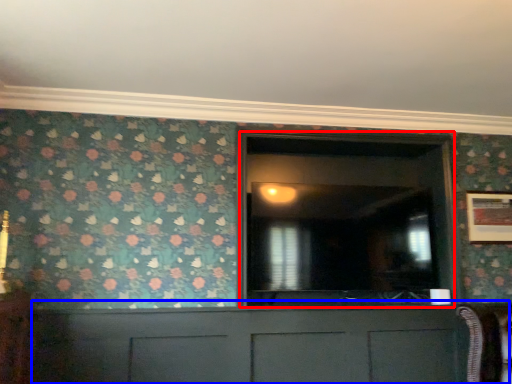
Question: Among these objects, which one is nearest to the camera, glass door (highlighted by a red box) or cabinetry (highlighted by a blue box)?

Choices:
 (A) glass door
 (B) cabinetry

Answer: (B)